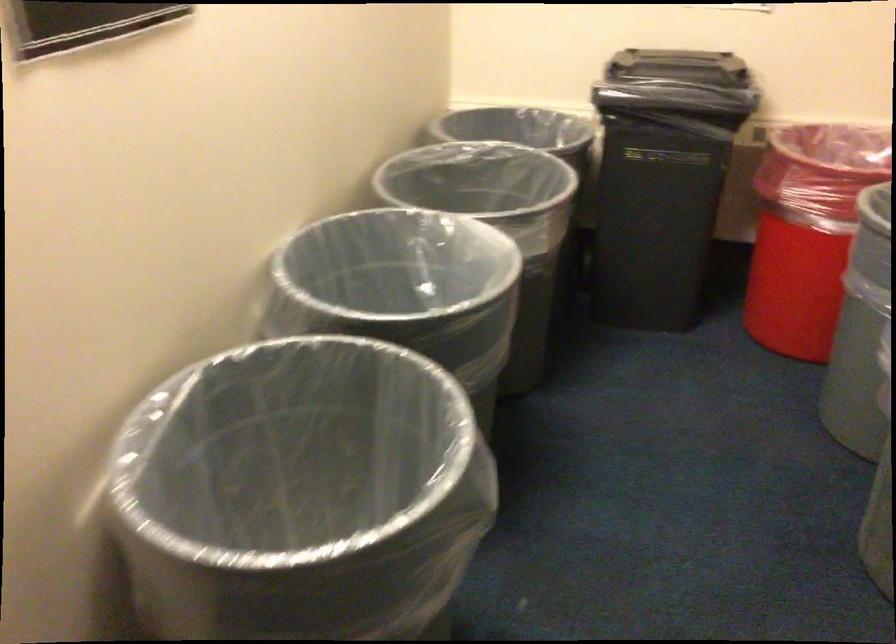
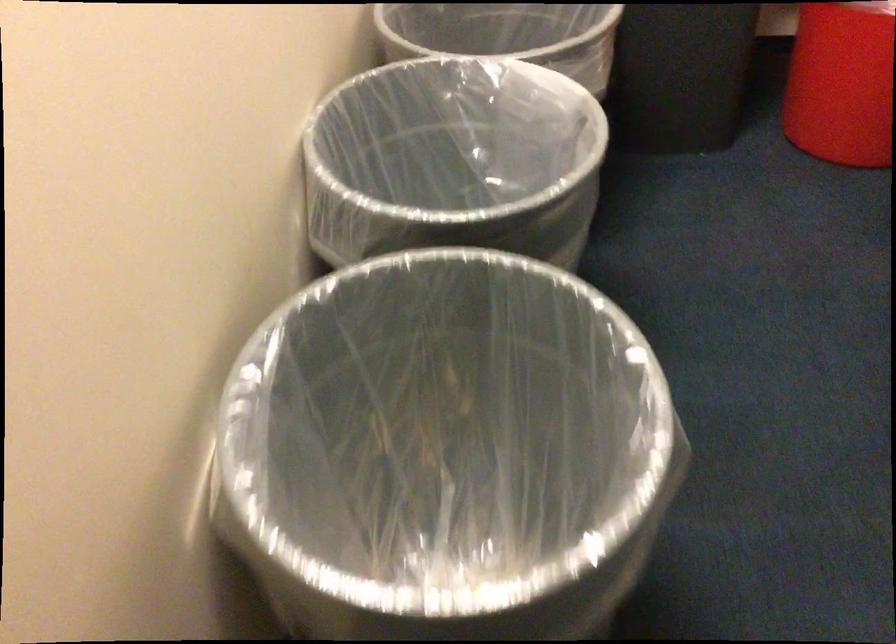
In a continuous first-person perspective shot, in which direction is the camera moving?

The cameraman walked toward left, forward.